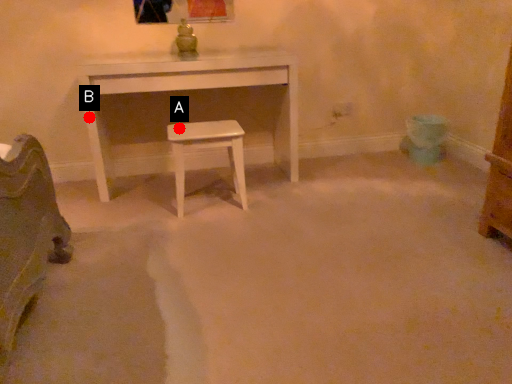
Question: Two points are circled on the image, labeled by A and B beside each circle. Which point is further to the camera?

Choices:
 (A) A is further
 (B) B is further

Answer: (B)